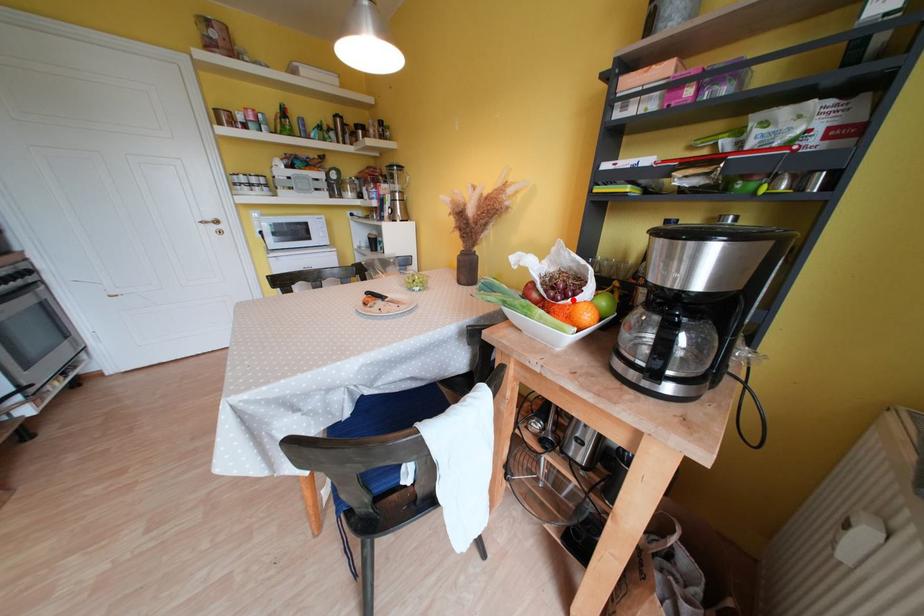
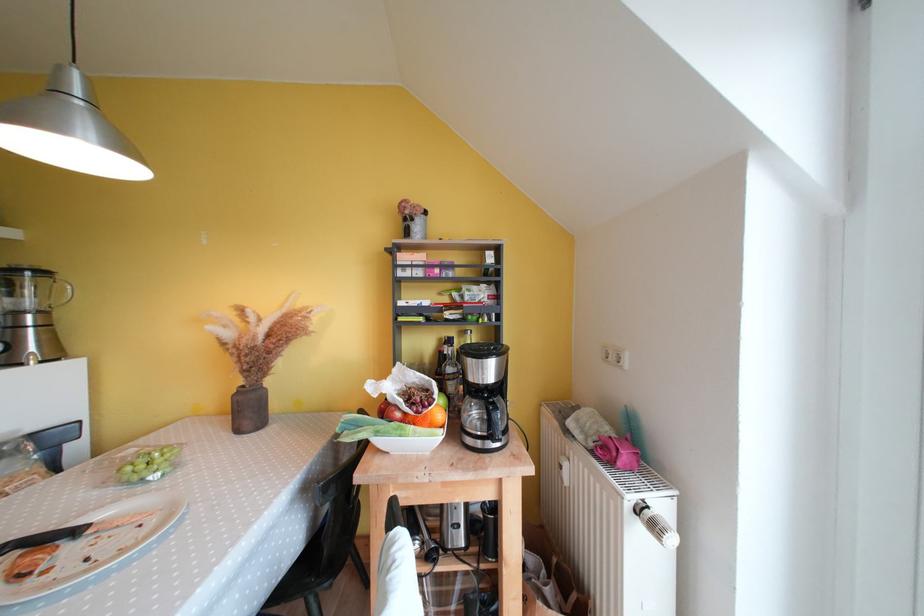
Locate, in the second image, the point that corresponds to the highlighted location in the first image.

(431, 411)